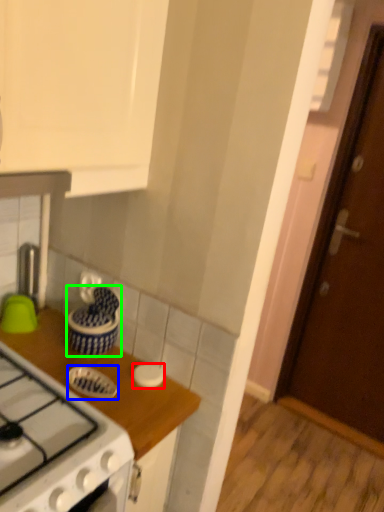
Question: Which is farther away from kitchen appliance (highlighted by a red box)? kitchen appliance (highlighted by a blue box) or kitchen appliance (highlighted by a green box)?

Choices:
 (A) kitchen appliance
 (B) kitchen appliance

Answer: (B)